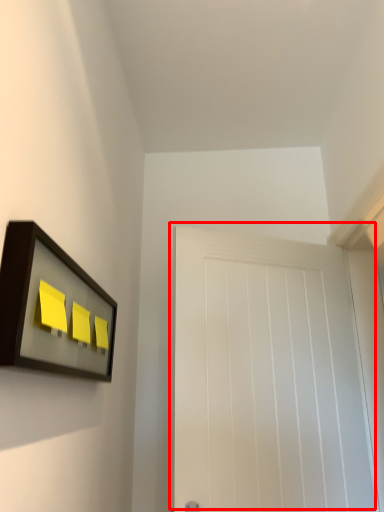
Question: From the image's perspective, where is door (annotated by the red box) located relative to picture frame?

Choices:
 (A) above
 (B) below

Answer: (B)